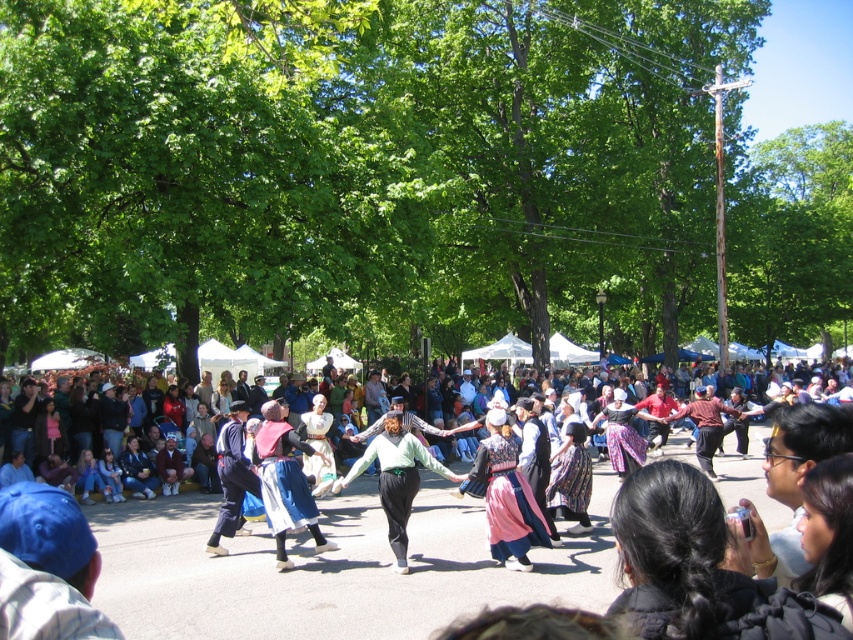
Is point (503, 541) farther from camera compared to point (381, 444)?

No, it is in front of (381, 444).

This screenshot has width=853, height=640. Find the location of `silk skirt at center`. silk skirt at center is located at coordinates (506, 497).

Locate an element on the screen. This screenshot has width=853, height=640. silk skirt at center is located at coordinates (506, 497).

Who is more forward, (260,444) or (675,435)?

Point (260,444) is more forward.

Does matte blue skirt at center have a lesser width compared to multicolored fabric crowd at center?

Yes.

What do you see at coordinates (285, 483) in the screenshot? The width and height of the screenshot is (853, 640). I see `matte blue skirt at center` at bounding box center [285, 483].

Locate an element on the screen. The image size is (853, 640). matte blue skirt at center is located at coordinates (285, 483).

Is matte blue skirt at center positioned at the back of green fabric skirt at center?

Yes, it is behind green fabric skirt at center.

Between matte blue skirt at center and green fabric skirt at center, which one appears on the left side from the viewer's perspective?

Positioned to the left is matte blue skirt at center.

Does point (265, 456) lie in front of point (379, 468)?

Yes.

You are a GUI agent. You are given a task and a screenshot of the screen. Output one action in this format:
    pyautogui.click(x=<x>, y=<y>)
    Task: Click on the matte blue skirt at center
    Image resolution: width=853 pixels, height=640 pixels.
    Given the screenshot: What is the action you would take?
    pyautogui.click(x=285, y=483)